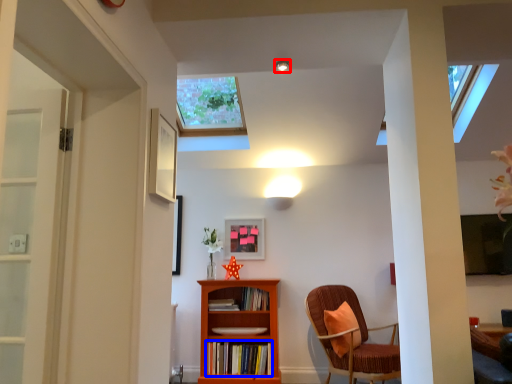
Question: Which of the following is the farthest to the observer, light fixture (highlighted by a red box) or book (highlighted by a blue box)?

Choices:
 (A) light fixture
 (B) book

Answer: (B)